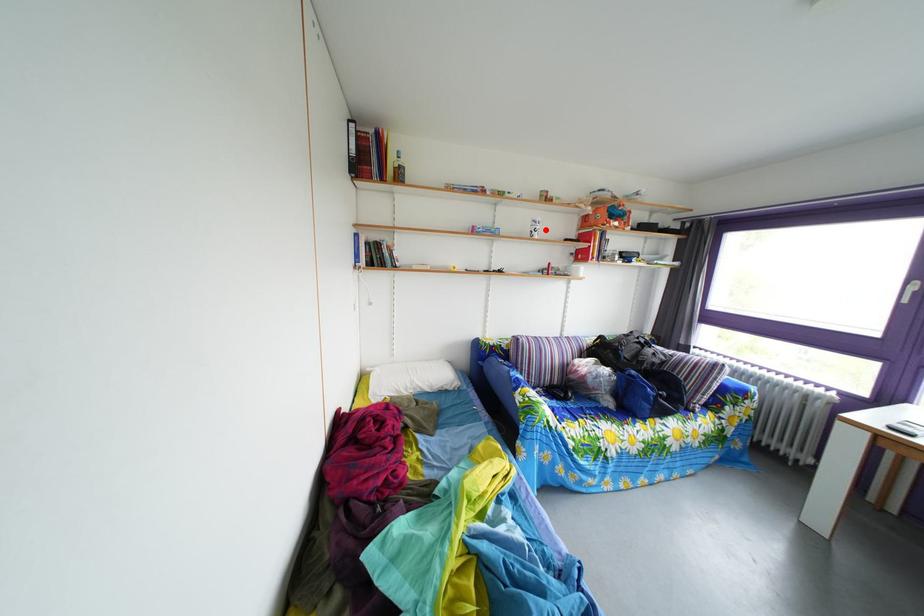
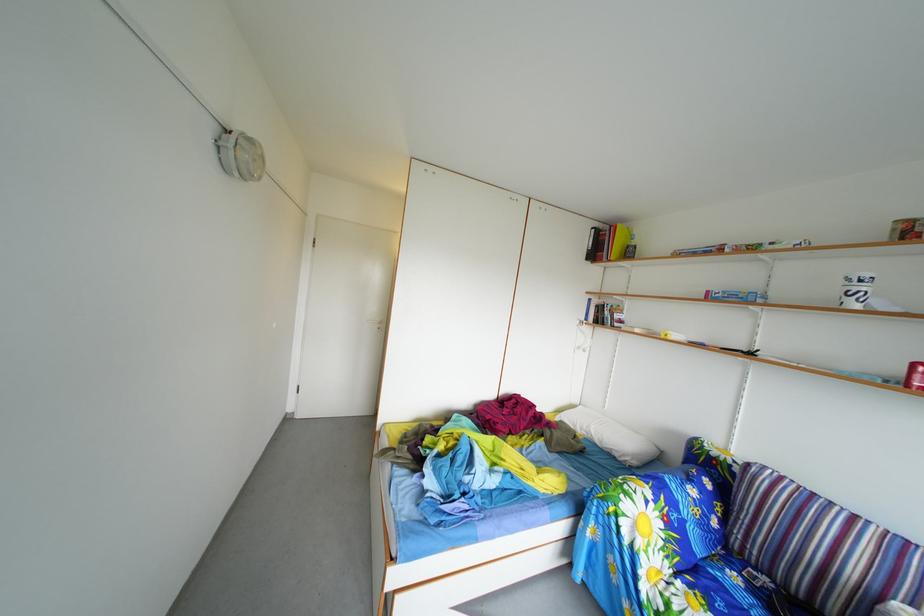
The point at the highlighted location is marked in the first image. Where is the corresponding point in the second image?

(859, 288)